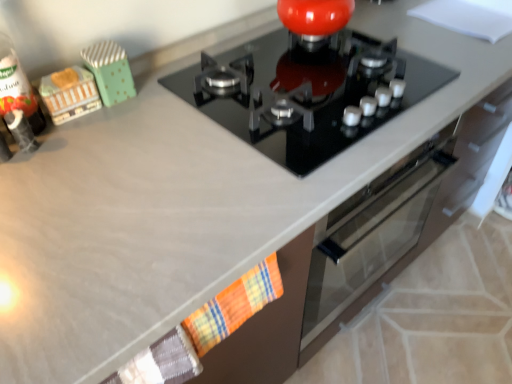
Question: Relative to black glass gas stove at center, is plaid fabric hand towel at lower center in front or behind?

Choices:
 (A) front
 (B) behind

Answer: (A)

Question: From the image's perspective, is plaid fabric hand towel at lower center positioned above or below black glass gas stove at center?

Choices:
 (A) below
 (B) above

Answer: (A)

Question: Estimate the real-world distances between objects in this image. Which object is farther from the black glass gas stove at center?

Choices:
 (A) plaid fabric hand towel at lower center
 (B) wooden toy train at left, the 1th toy positioned from the left
 (C) green polka dot fabric at upper left, the 1th toy in the right-to-left sequence

Answer: (A)

Question: Considering the real-world distances, which object is farthest from the black glass gas stove at center?

Choices:
 (A) plaid fabric hand towel at lower center
 (B) wooden toy train at left, marked as the second toy in a right-to-left arrangement
 (C) green polka dot fabric at upper left, the 1th toy in the right-to-left sequence

Answer: (A)